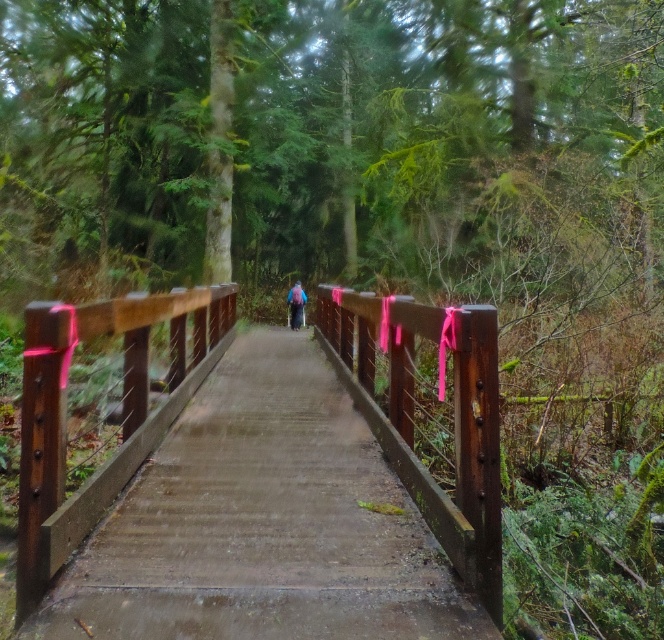
Based on the photo, does rustic wood bridge at center appear on the right side of purple fabric backpack at center?

In fact, rustic wood bridge at center is to the left of purple fabric backpack at center.

Does rustic wood bridge at center have a lesser height compared to purple fabric backpack at center?

Correct, rustic wood bridge at center is not as tall as purple fabric backpack at center.

You are a GUI agent. You are given a task and a screenshot of the screen. Output one action in this format:
    pyautogui.click(x=<x>, y=<y>)
    Task: Click on the rustic wood bridge at center
    
    Given the screenshot: What is the action you would take?
    pyautogui.click(x=122, y=416)